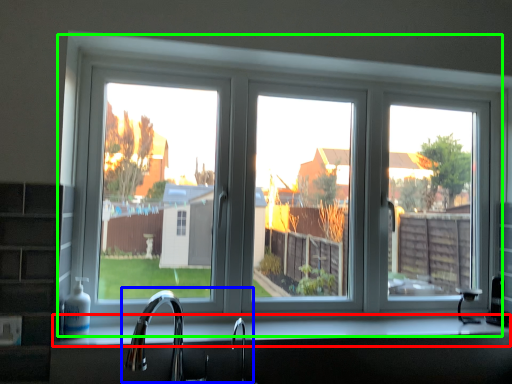
Question: Estimate the real-world distances between objects in this image. Which object is farther from counter top (highlighted by a red box), sink (highlighted by a blue box) or window (highlighted by a green box)?

Choices:
 (A) sink
 (B) window

Answer: (B)